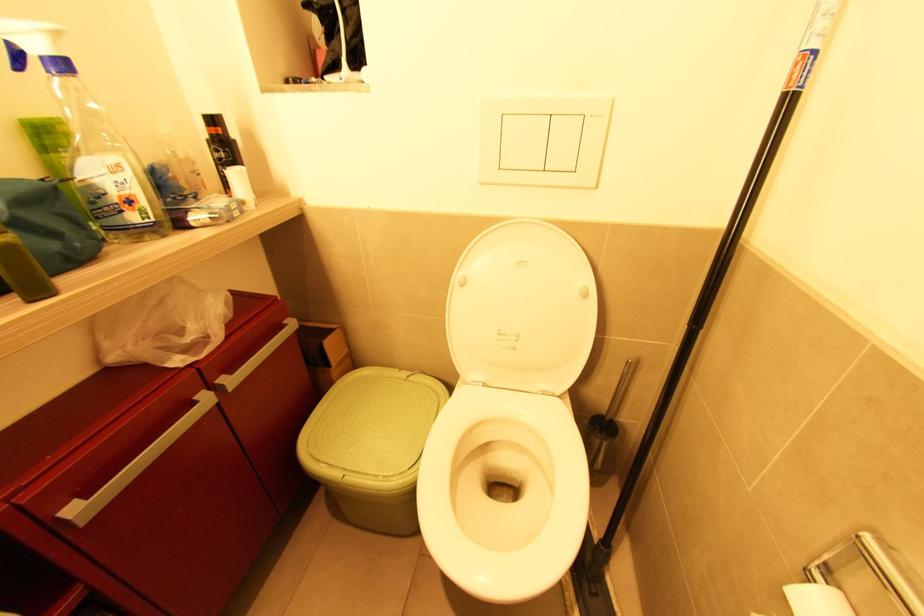
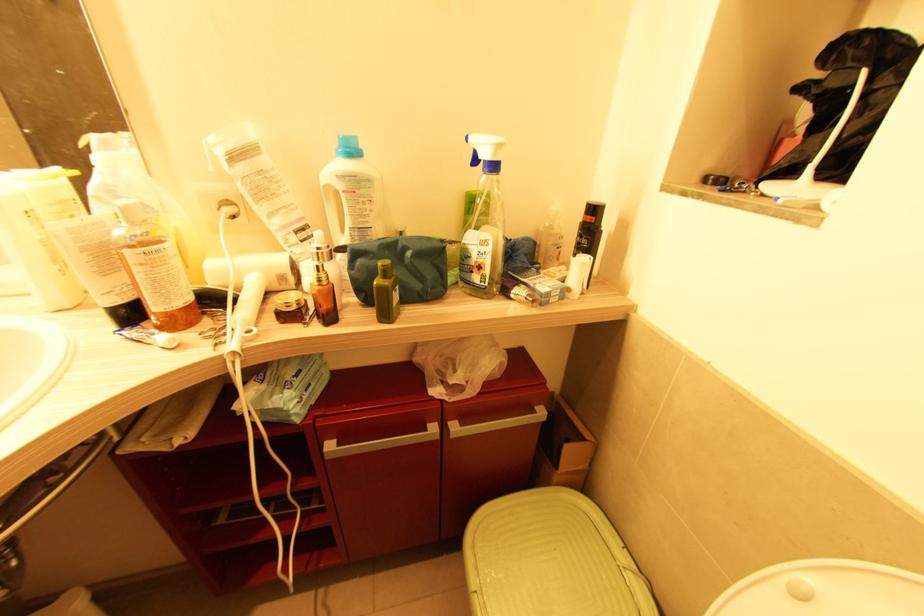
In the second image, find the point that corresponds to point (232, 390) in the first image.

(454, 438)